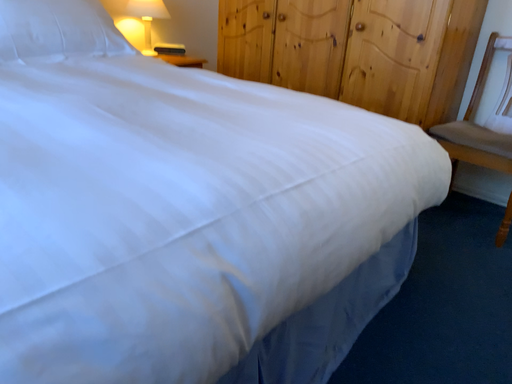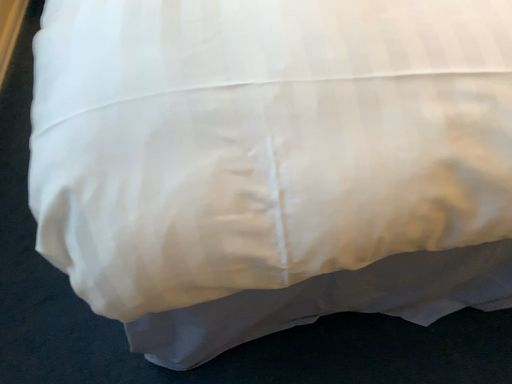
Question: Which way did the camera rotate in the video?

Choices:
 (A) rotated downward
 (B) rotated upward

Answer: (A)